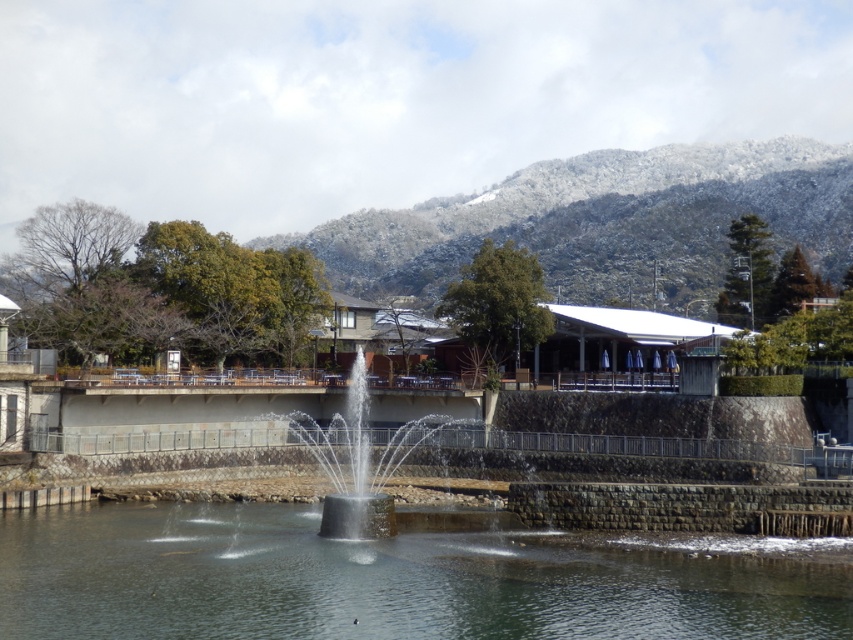
This screenshot has width=853, height=640. What do you see at coordinates (605, 221) in the screenshot? I see `snow-covered mountain at upper center` at bounding box center [605, 221].

Can you confirm if snow-covered mountain at upper center is positioned to the left of black concrete fountain at center?

No, snow-covered mountain at upper center is not to the left of black concrete fountain at center.

This screenshot has width=853, height=640. I want to click on snow-covered mountain at upper center, so click(605, 221).

Can you confirm if clear water at center is wider than snow-covered mountain at upper center?

No.

How distant is clear water at center from snow-covered mountain at upper center?

clear water at center is 131.09 meters away from snow-covered mountain at upper center.

Image resolution: width=853 pixels, height=640 pixels. I want to click on clear water at center, so click(387, 580).

The image size is (853, 640). Identify the location of clear water at center. (387, 580).

Who is higher up, clear water at center or black concrete fountain at center?

black concrete fountain at center is higher up.

Does point (639, 580) lie in front of point (331, 483)?

Yes, point (639, 580) is in front of point (331, 483).

Locate an element on the screen. The width and height of the screenshot is (853, 640). clear water at center is located at coordinates (387, 580).